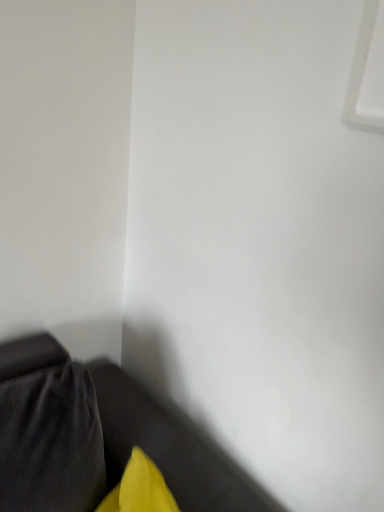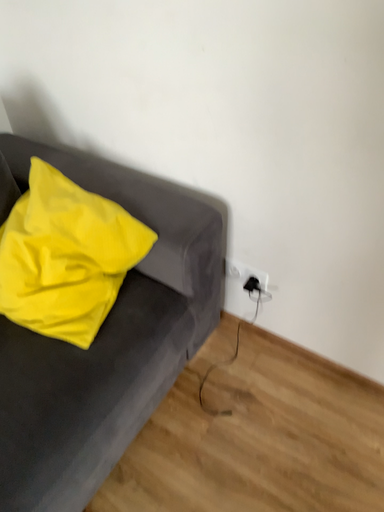
Question: How did the camera likely rotate when shooting the video?

Choices:
 (A) rotated right
 (B) rotated left

Answer: (A)